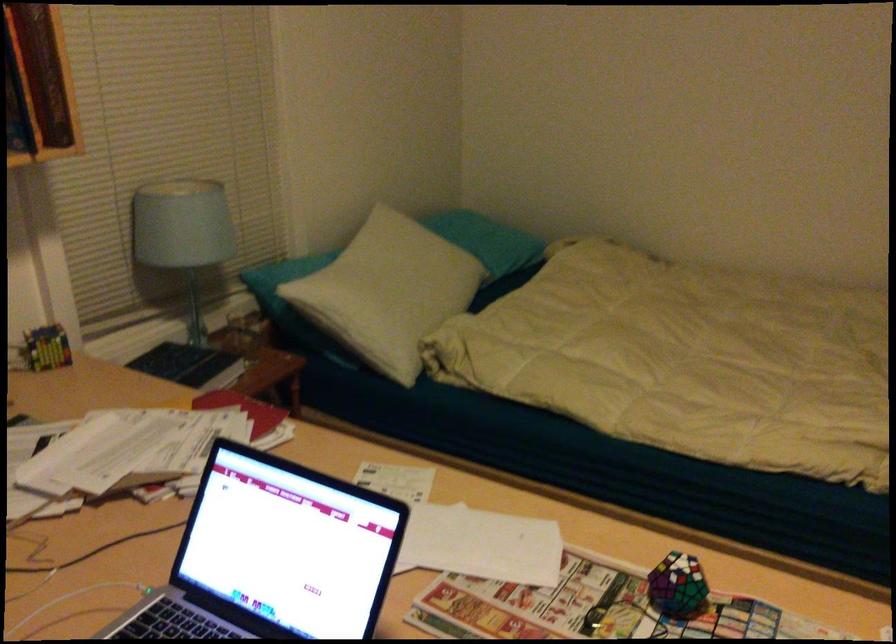
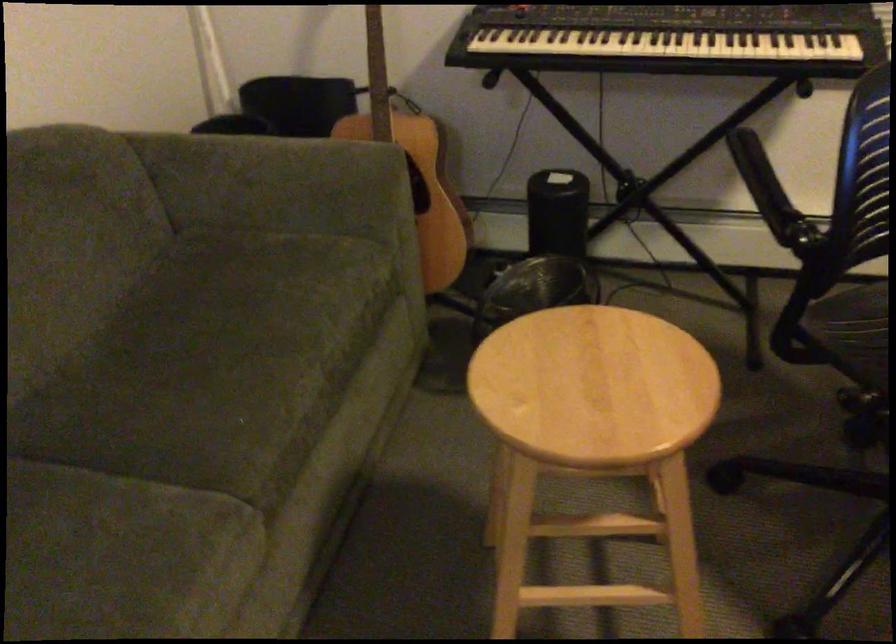
The first image is from the beginning of the video and the second image is from the end. How did the camera likely rotate when shooting the video?

The camera's rotation is toward left-down.